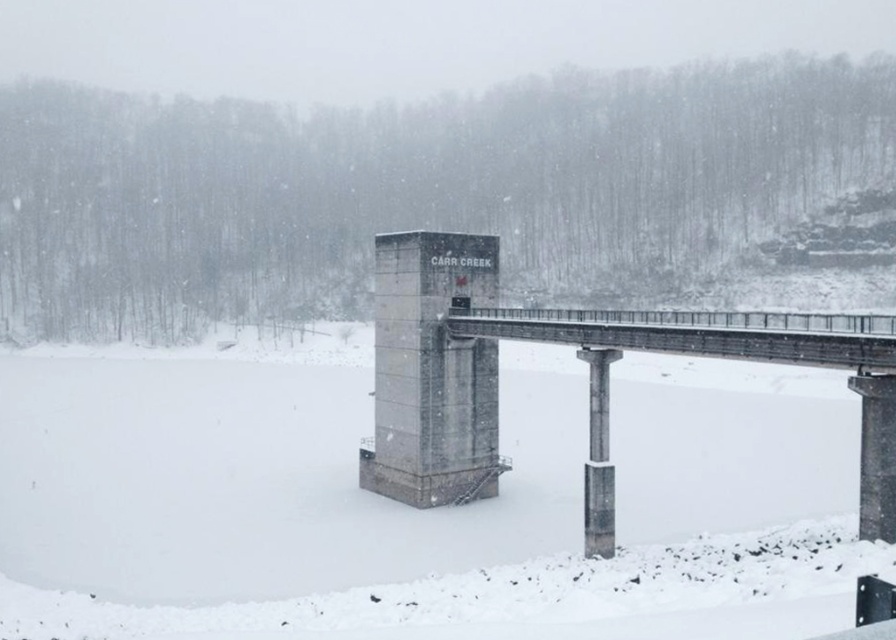
You are standing at the base of the CARR CREEK bridge tower and want to reach a point marked at coordinates point (x=698, y=436). Given that the bridge is 100 meters long, is the point within the bridge structure?

The distance between you and the point (x=698, y=436) is 81.80 meters, which is less than the bridge length of 100 meters. Therefore, the point is within the bridge structure.

You are standing on the path leading to the bridge and want to know which object is nearer to you between the white matte snow at center and the concrete bridge at center. Can you tell me?

The white matte snow at center is closer to the viewer than the concrete bridge at center, so the white matte snow at center is nearer to you.